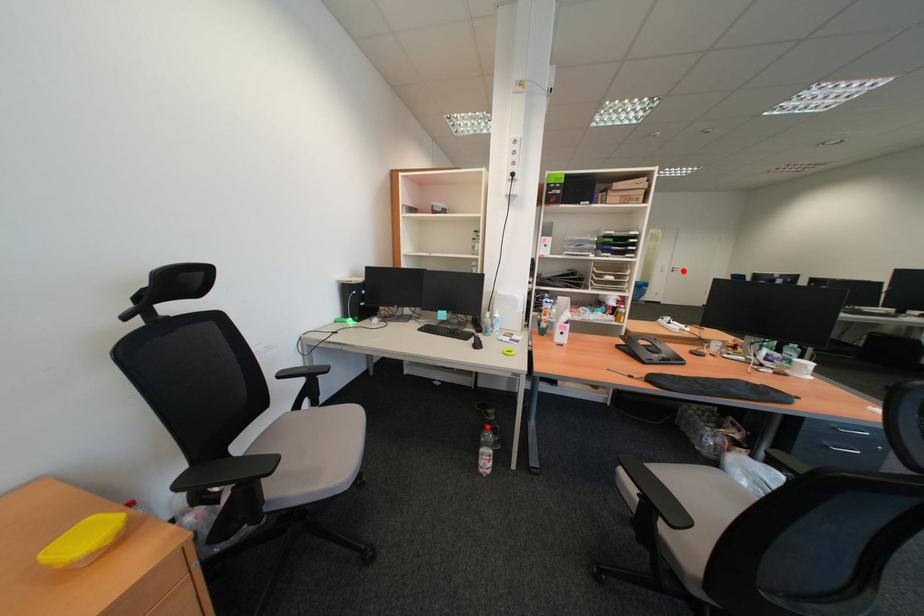
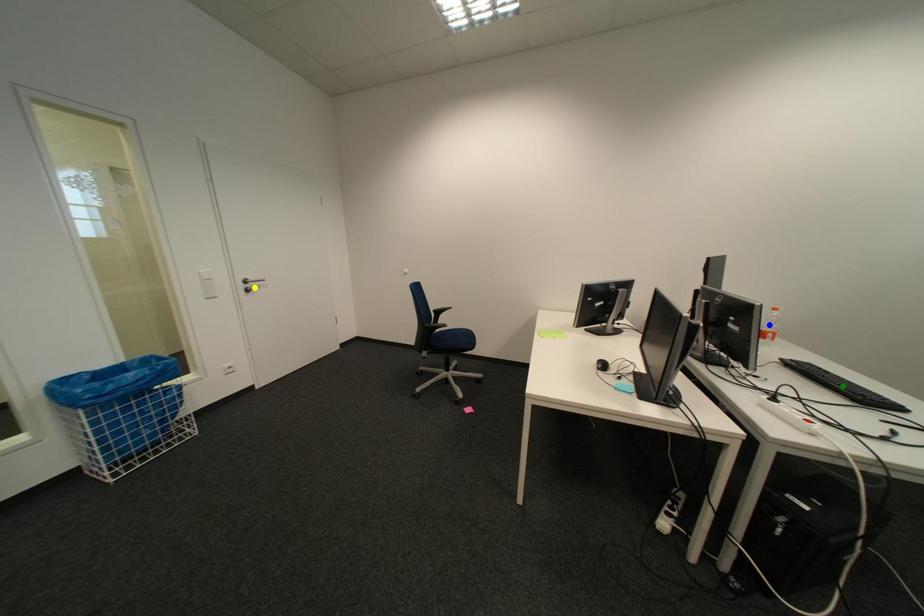
Question: I am providing you with two images of the same scene from different viewpoints. A red point is marked on the first image. You are given multiple points on the second image. In image 2, which mark is for the same physical point as the one in image 1?

Choices:
 (A) blue point
 (B) green point
 (C) yellow point

Answer: (C)